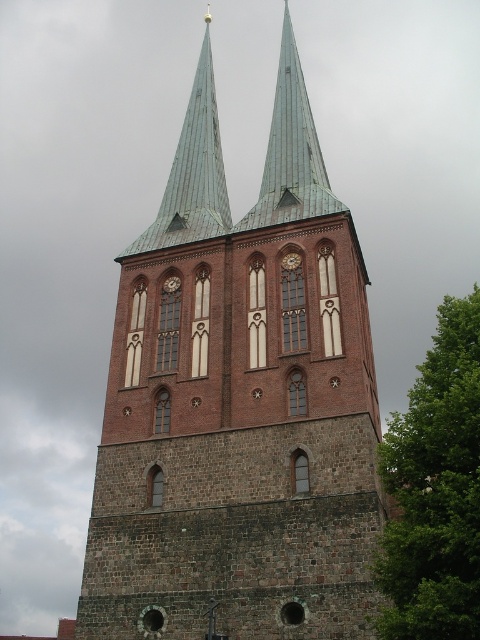
Can you confirm if brick tower at center is bigger than green copper spire at upper center?

Yes, brick tower at center is bigger than green copper spire at upper center.

Which is more to the right, brick tower at center or green copper spire at upper center?

Result: brick tower at center

Is point (300, 580) less distant than point (191, 141)?

Yes, point (300, 580) is closer to viewer.

The width and height of the screenshot is (480, 640). Identify the location of brick tower at center. (239, 403).

What do you see at coordinates (434, 490) in the screenshot? I see `green leafy tree at right` at bounding box center [434, 490].

Between point (472, 536) and point (320, 202), which one is positioned in front?

Point (472, 536)

Where is `green leafy tree at right`? green leafy tree at right is located at coordinates (434, 490).

How much distance is there between brick tower at center and green leafy tree at right?

The distance of brick tower at center from green leafy tree at right is 27.02 meters.

Does point (181, 170) come closer to viewer compared to point (451, 387)?

No, (181, 170) is behind (451, 387).

The width and height of the screenshot is (480, 640). In order to click on brick tower at center in this screenshot , I will do `click(239, 403)`.